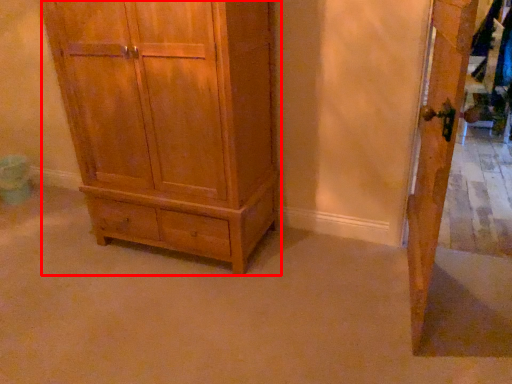
Question: From the image's perspective, where is chest of drawers (annotated by the red box) located in relation to door in the image?

Choices:
 (A) above
 (B) below

Answer: (A)